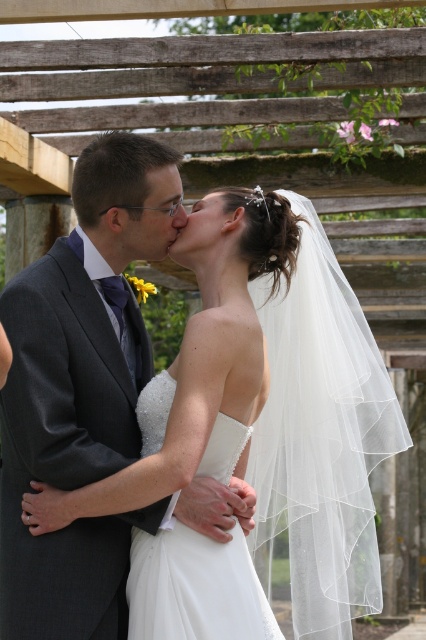
You are a photographer capturing the wedding couple under the pergola. You notice the white satin wedding dress at center and the matte white forehead at upper center. Which object is positioned to the left of the other?

The white satin wedding dress at center is to the left of the matte white forehead at upper center.

You are a photographer at the wedding and want to capture a closeup shot of the bride and groom. Since the white satin wedding dress at center is larger than the matte white forehead at upper center, which object should you focus on to ensure both are in frame?

The photographer should focus on the white satin wedding dress at center because it is larger than the matte white forehead at upper center, ensuring both are in frame.